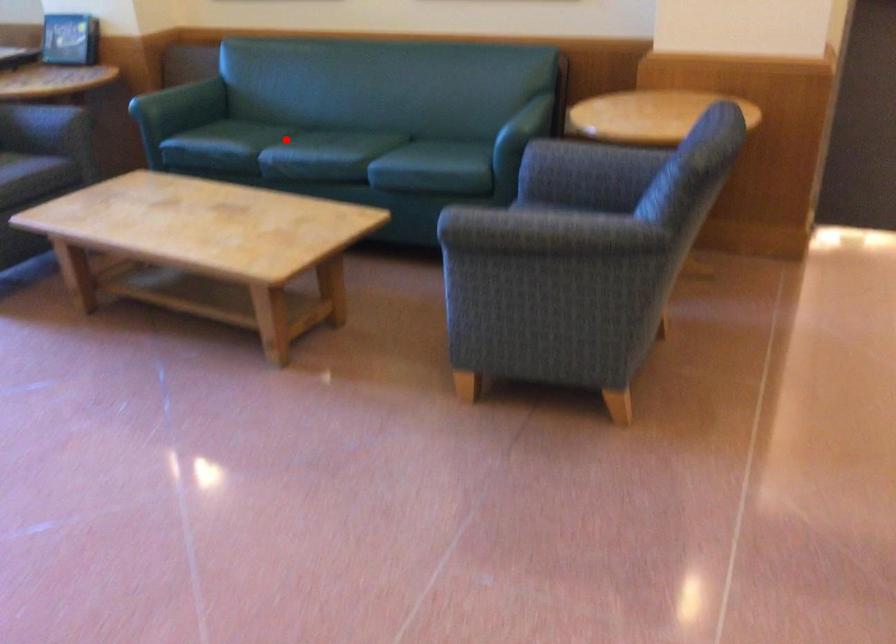
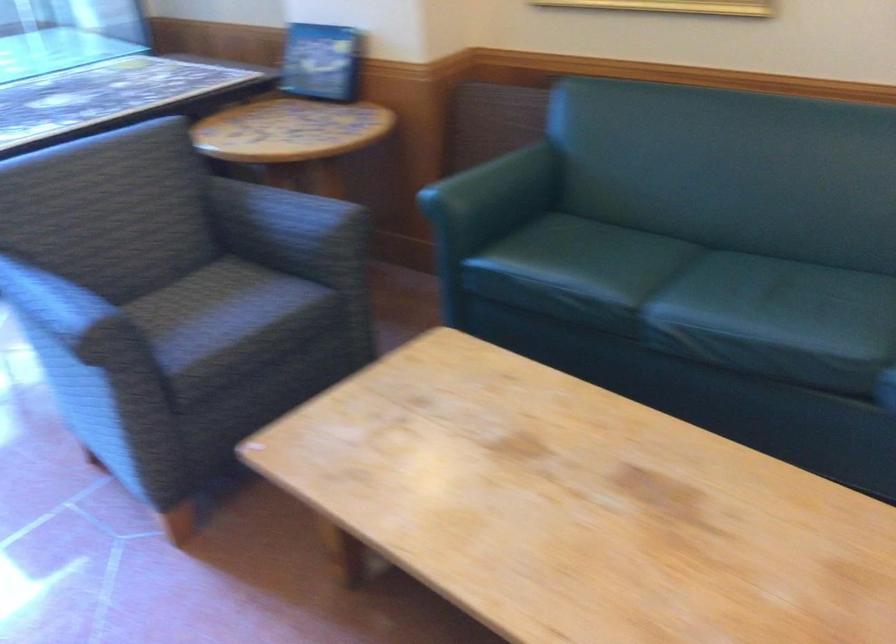
Question: I am providing you with two images of the same scene from different viewpoints. Given a red point in image1, look at the same physical point in image2. Is it:

Choices:
 (A) Closer to the viewpoint
 (B) Farther from the viewpoint

Answer: (A)